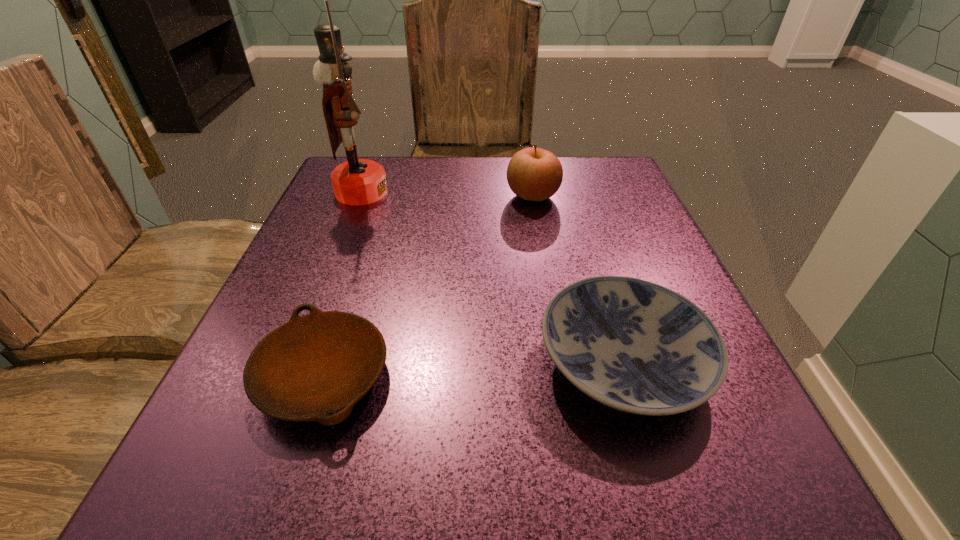
Where is `vacant space at the near left corner of the desktop`? vacant space at the near left corner of the desktop is located at coordinates (190, 467).

In the image, there is a desktop. Identify the location of vacant space at the far right corner. (596, 186).

Find the location of `vacant space that is in between the right plate and the apple`. vacant space that is in between the right plate and the apple is located at coordinates (578, 279).

This screenshot has height=540, width=960. In order to click on blank region between the third tallest object and the left plate in this screenshot , I will do (x=473, y=369).

This screenshot has height=540, width=960. Identify the location of free space that is in between the shorter plate and the right plate. (473, 369).

You are a GUI agent. You are given a task and a screenshot of the screen. Output one action in this format:
    pyautogui.click(x=<x>, y=<y>)
    Task: Click on the free space between the second tallest object and the shorter plate
    The height and width of the screenshot is (540, 960).
    Given the screenshot: What is the action you would take?
    pyautogui.click(x=428, y=286)

Locate an element on the screen. Image resolution: width=960 pixels, height=540 pixels. free space between the right plate and the apple is located at coordinates (578, 279).

Where is `vacant point located between the shorter plate and the taller plate`? This screenshot has width=960, height=540. vacant point located between the shorter plate and the taller plate is located at coordinates [x=473, y=369].

The image size is (960, 540). I want to click on vacant space in between the left plate and the right plate, so click(x=473, y=369).

At what (x,y) coordinates should I click in order to perform the action: click on free point between the nutcracker and the taller plate. Please return your answer as a coordinate pair (x, y). This screenshot has width=960, height=540. Looking at the image, I should click on (492, 277).